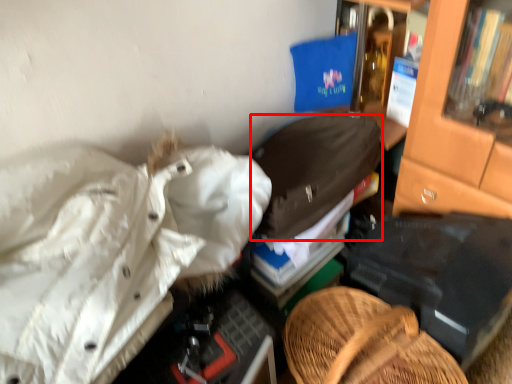
Question: Where is clothing (annotated by the red box) located in relation to clothing in the image?

Choices:
 (A) right
 (B) left

Answer: (A)